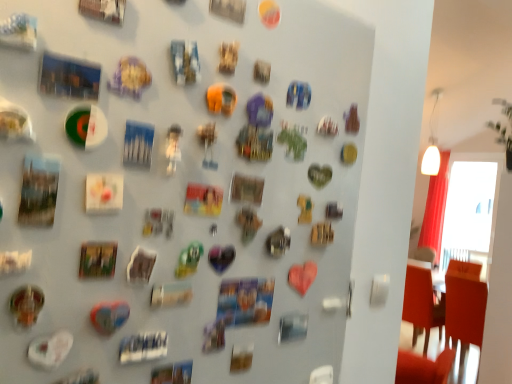
Question: Considering the relative positions of shiny metallic heart at center, which appears as the first art when ordered from the bottom, and white glass window screen at upper right in the image provided, is shiny metallic heart at center, which appears as the first art when ordered from the bottom, to the right of white glass window screen at upper right from the viewer's perspective?

Choices:
 (A) no
 (B) yes

Answer: (A)

Question: Can white glass window screen at upper right be found inside shiny metallic heart at center, acting as the 6th art starting from the top?

Choices:
 (A) yes
 (B) no

Answer: (B)

Question: From a real-world perspective, is shiny metallic heart at center, acting as the 6th art starting from the top, on top of white glass window screen at upper right?

Choices:
 (A) yes
 (B) no

Answer: (B)

Question: Is shiny metallic heart at center, acting as the 6th art starting from the top, completely or partially outside of white glass window screen at upper right?

Choices:
 (A) no
 (B) yes

Answer: (B)

Question: Is shiny metallic heart at center, which appears as the first art when ordered from the bottom, far from white glass window screen at upper right?

Choices:
 (A) yes
 (B) no

Answer: (A)

Question: Based on their sizes in the image, would you say orange fabric chair at right is bigger or smaller than metallic gold coin at lower left, which appears as the second art when ordered from the bottom?

Choices:
 (A) small
 (B) big

Answer: (B)

Question: Is orange fabric chair at right taller or shorter than metallic gold coin at lower left, which appears as the second art when ordered from the bottom?

Choices:
 (A) short
 (B) tall

Answer: (B)

Question: From the image's perspective, is orange fabric chair at right above or below metallic gold coin at lower left, the 5th art in the top-to-bottom sequence?

Choices:
 (A) above
 (B) below

Answer: (B)

Question: Is orange fabric chair at right wider or thinner than metallic gold coin at lower left, the 5th art in the top-to-bottom sequence?

Choices:
 (A) thin
 (B) wide

Answer: (B)

Question: Choose the correct answer: Is metallic gold coin at lower left, which appears as the second art when ordered from the bottom, inside metallic silver magnet at center-left, which appears as the fourth art when viewed from the top, or outside it?

Choices:
 (A) inside
 (B) outside

Answer: (B)

Question: Based on their sizes in the image, would you say metallic gold coin at lower left, the 5th art in the top-to-bottom sequence, is bigger or smaller than metallic silver magnet at center-left, the 3th art positioned from the bottom?

Choices:
 (A) small
 (B) big

Answer: (B)

Question: Does point (19, 322) appear closer or farther from the camera than point (130, 274)?

Choices:
 (A) closer
 (B) farther

Answer: (A)

Question: Considering their positions, is metallic gold coin at lower left, which appears as the second art when ordered from the bottom, located in front of or behind metallic silver magnet at center-left, which appears as the fourth art when viewed from the top?

Choices:
 (A) behind
 (B) front

Answer: (B)

Question: Do you think metallic fridge magnets at center is within orange fabric chair at right, or outside of it?

Choices:
 (A) outside
 (B) inside

Answer: (A)

Question: In the image, is metallic fridge magnets at center positioned in front of or behind orange fabric chair at right?

Choices:
 (A) behind
 (B) front

Answer: (B)